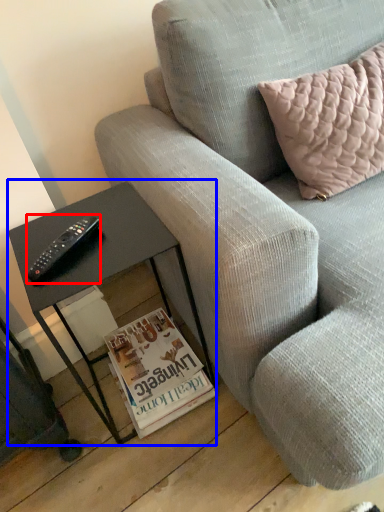
Question: Among these objects, which one is nearest to the camera, remote (highlighted by a red box) or table (highlighted by a blue box)?

Choices:
 (A) remote
 (B) table

Answer: (B)